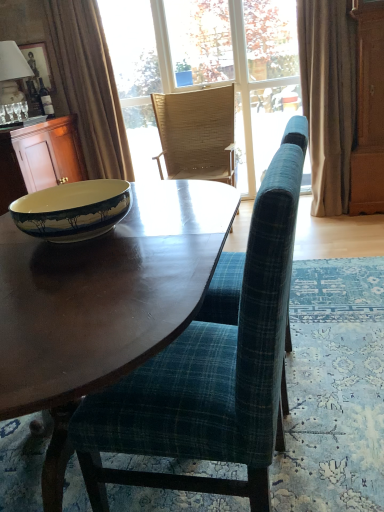
Question: From a real-world perspective, is white fabric lampshade at upper left over matte glass bottle at upper left?

Choices:
 (A) yes
 (B) no

Answer: (A)

Question: From a real-world perspective, is white fabric lampshade at upper left physically below matte glass bottle at upper left?

Choices:
 (A) no
 (B) yes

Answer: (A)

Question: Could you tell me if white fabric lampshade at upper left is turned towards matte glass bottle at upper left?

Choices:
 (A) no
 (B) yes

Answer: (B)

Question: Is white fabric lampshade at upper left touching matte glass bottle at upper left?

Choices:
 (A) no
 (B) yes

Answer: (A)

Question: Is matte glass bottle at upper left at the back of white fabric lampshade at upper left?

Choices:
 (A) yes
 (B) no

Answer: (B)

Question: Is wooden cabinet at left bigger or smaller than wooden picture frame at upper left?

Choices:
 (A) big
 (B) small

Answer: (A)

Question: Is wooden cabinet at left inside the boundaries of wooden picture frame at upper left, or outside?

Choices:
 (A) inside
 (B) outside

Answer: (B)

Question: From a real-world perspective, relative to wooden picture frame at upper left, is wooden cabinet at left vertically above or below?

Choices:
 (A) above
 (B) below

Answer: (B)

Question: Considering the positions of wooden cabinet at left and wooden picture frame at upper left in the image, is wooden cabinet at left wider or thinner than wooden picture frame at upper left?

Choices:
 (A) wide
 (B) thin

Answer: (A)

Question: From the image's perspective, relative to matte glass bottle at upper left, is wooden screen door at right above or below?

Choices:
 (A) above
 (B) below

Answer: (B)

Question: Considering the relative positions of wooden screen door at right and matte glass bottle at upper left in the image provided, is wooden screen door at right to the left or to the right of matte glass bottle at upper left?

Choices:
 (A) right
 (B) left

Answer: (A)

Question: Which is correct: wooden screen door at right is inside matte glass bottle at upper left, or outside of it?

Choices:
 (A) outside
 (B) inside

Answer: (A)

Question: Is wooden screen door at right taller or shorter than matte glass bottle at upper left?

Choices:
 (A) tall
 (B) short

Answer: (A)

Question: From the image's perspective, is wooden cabinet at left above or below brown fabric curtain at upper left, which is the first curtain in left-to-right order?

Choices:
 (A) below
 (B) above

Answer: (A)

Question: Considering the positions of wooden cabinet at left and brown fabric curtain at upper left, the 2th curtain in the right-to-left sequence, in the image, is wooden cabinet at left bigger or smaller than brown fabric curtain at upper left, the 2th curtain in the right-to-left sequence,?

Choices:
 (A) small
 (B) big

Answer: (B)